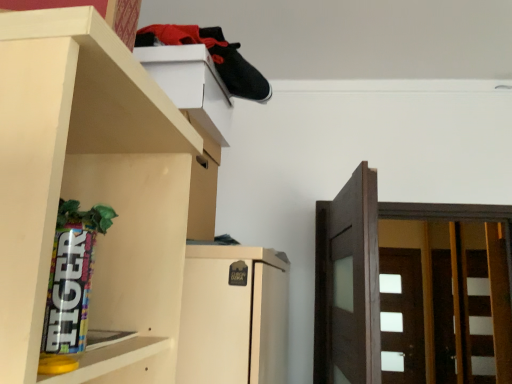
Where is `white matte cabinet at upper center`? white matte cabinet at upper center is located at coordinates (191, 85).

Find the location of a particular element. This screenshot has height=384, width=512. white glossy door at right, the second door viewed from the front is located at coordinates (402, 316).

Based on the photo, from the image's perspective, does dark brown wood door at right, placed as the first door when sorted from top to bottom, appear lower than white matte cabinet at upper center?

Yes.

There is a dark brown wood door at right, which is the second door in bottom-to-top order. Identify the location of cabinet above it (from a real-world perspective). (191, 85).

From a real-world perspective, is dark brown wood door at right, which is the second door in bottom-to-top order, above or below white matte cabinet at upper center?

Clearly, from a real-world perspective, dark brown wood door at right, which is the second door in bottom-to-top order, is below white matte cabinet at upper center.

Is dark brown wood door at right, which is the second door in bottom-to-top order, next to white matte cabinet at upper center and touching it?

No, dark brown wood door at right, which is the second door in bottom-to-top order, is not next to white matte cabinet at upper center.

Is white glossy door at right, marked as the 2th door in a top-to-bottom arrangement, completely or partially outside of white matte cabinet at upper center?

white glossy door at right, marked as the 2th door in a top-to-bottom arrangement, is positioned outside white matte cabinet at upper center.

Looking at the image, does white glossy door at right, the second door viewed from the front, seem bigger or smaller compared to white matte cabinet at upper center?

In the image, white glossy door at right, the second door viewed from the front, appears to be larger than white matte cabinet at upper center.

Does white glossy door at right, marked as the 2th door in a top-to-bottom arrangement, touch white matte cabinet at upper center?

white glossy door at right, marked as the 2th door in a top-to-bottom arrangement, and white matte cabinet at upper center are clearly separated.

Between white glossy door at right, marked as the 2th door in a top-to-bottom arrangement, and dark brown wood door at right, the 1th door positioned from the front, which one has larger width?

dark brown wood door at right, the 1th door positioned from the front.

How far apart are white glossy door at right, the second door viewed from the front, and dark brown wood door at right, placed as the second door when sorted from back to front?

A distance of 8.78 feet exists between white glossy door at right, the second door viewed from the front, and dark brown wood door at right, placed as the second door when sorted from back to front.

Is white glossy door at right, which is the second door from left to right, oriented away from dark brown wood door at right, placed as the first door when sorted from top to bottom?

No, white glossy door at right, which is the second door from left to right,'s orientation is not away from dark brown wood door at right, placed as the first door when sorted from top to bottom.

Identify the location of door below the dark brown wood door at right, the 1th door positioned from the front (from the image's perspective). The height and width of the screenshot is (384, 512). (402, 316).

Which object is wider, white matte cabinet at upper center or dark brown wood door at right, the 1th door positioned from the front?

dark brown wood door at right, the 1th door positioned from the front, is wider.

Is white matte cabinet at upper center oriented away from dark brown wood door at right, placed as the second door when sorted from back to front?

That's not correct — white matte cabinet at upper center is not looking away from dark brown wood door at right, placed as the second door when sorted from back to front.

Is white matte cabinet at upper center directly adjacent to dark brown wood door at right, the 1th door positioned from the front?

No.

Considering the positions of objects white matte cabinet at upper center and dark brown wood door at right, arranged as the first door when viewed from the left, in the image provided, who is more to the left, white matte cabinet at upper center or dark brown wood door at right, arranged as the first door when viewed from the left,?

white matte cabinet at upper center.

Which is behind, dark brown wood door at right, placed as the first door when sorted from top to bottom, or white glossy door at right, arranged as the first door when ordered from the bottom?

white glossy door at right, arranged as the first door when ordered from the bottom, is further away from the camera.

Considering the sizes of objects dark brown wood door at right, placed as the second door when sorted from back to front, and white glossy door at right, the second door viewed from the front, in the image provided, who is thinner, dark brown wood door at right, placed as the second door when sorted from back to front, or white glossy door at right, the second door viewed from the front,?

With smaller width is white glossy door at right, the second door viewed from the front.

From a real-world perspective, is dark brown wood door at right, arranged as the first door when viewed from the left, physically below white glossy door at right, the second door viewed from the front?

Incorrect, from a real-world perspective, dark brown wood door at right, arranged as the first door when viewed from the left, is higher than white glossy door at right, the second door viewed from the front.

Identify the location of door that is below the dark brown wood door at right, which is the second door in bottom-to-top order (from the image's perspective). The width and height of the screenshot is (512, 384). (402, 316).

Does white matte cabinet at upper center have a larger size compared to white glossy door at right, the second door viewed from the front?

Actually, white matte cabinet at upper center might be smaller than white glossy door at right, the second door viewed from the front.

At what (x,y) coordinates should I click in order to perform the action: click on cabinet that appears above the white glossy door at right, the first door when ordered from right to left (from the image's perspective). Please return your answer as a coordinate pair (x, y). The width and height of the screenshot is (512, 384). Looking at the image, I should click on (191, 85).

Which object is further away from the camera taking this photo, white matte cabinet at upper center or white glossy door at right, the first door when ordered from right to left?

Positioned behind is white glossy door at right, the first door when ordered from right to left.

Does point (217, 120) come in front of point (398, 285)?

Yes, it is in front of point (398, 285).

From a real-world perspective, count 1st doors downward from the white matte cabinet at upper center and point to it. Please provide its 2D coordinates.

[(348, 284)]

Where is `the 2nd door behind the white matte cabinet at upper center, counting from the anchor's position`? the 2nd door behind the white matte cabinet at upper center, counting from the anchor's position is located at coordinates (402, 316).

Based on their spatial positions, is white matte cabinet at upper center or white glossy door at right, the first door when ordered from right to left, closer to dark brown wood door at right, placed as the second door when sorted from back to front?

white matte cabinet at upper center.

Looking at the image, which one is located further to white matte cabinet at upper center, dark brown wood door at right, the 1th door positioned from the front, or white glossy door at right, arranged as the first door when ordered from the bottom?

white glossy door at right, arranged as the first door when ordered from the bottom, is further to white matte cabinet at upper center.

Based on the photo, when comparing their distances from white glossy door at right, which is the 1th door in back-to-front order, does dark brown wood door at right, the 1th door positioned from the front, or white matte cabinet at upper center seem closer?

Among the two, dark brown wood door at right, the 1th door positioned from the front, is located nearer to white glossy door at right, which is the 1th door in back-to-front order.

Looking at the image, which one is located closer to dark brown wood door at right, which ranks as the second door in right-to-left order, white glossy door at right, which is the second door from left to right, or white matte cabinet at upper center?

white matte cabinet at upper center.

From the image, which object appears to be nearer to white glossy door at right, the second door viewed from the front, white matte cabinet at upper center or dark brown wood door at right, which ranks as the second door in right-to-left order?

dark brown wood door at right, which ranks as the second door in right-to-left order, lies closer to white glossy door at right, the second door viewed from the front, than the other object.

Considering their positions, is white glossy door at right, the first door when ordered from right to left, positioned closer to white matte cabinet at upper center than dark brown wood door at right, which ranks as the second door in right-to-left order?

Among the two, dark brown wood door at right, which ranks as the second door in right-to-left order, is located nearer to white matte cabinet at upper center.

Locate an element on the screen. door between white matte cabinet at upper center and white glossy door at right, which is the second door from left to right, along the z-axis is located at coordinates (348, 284).